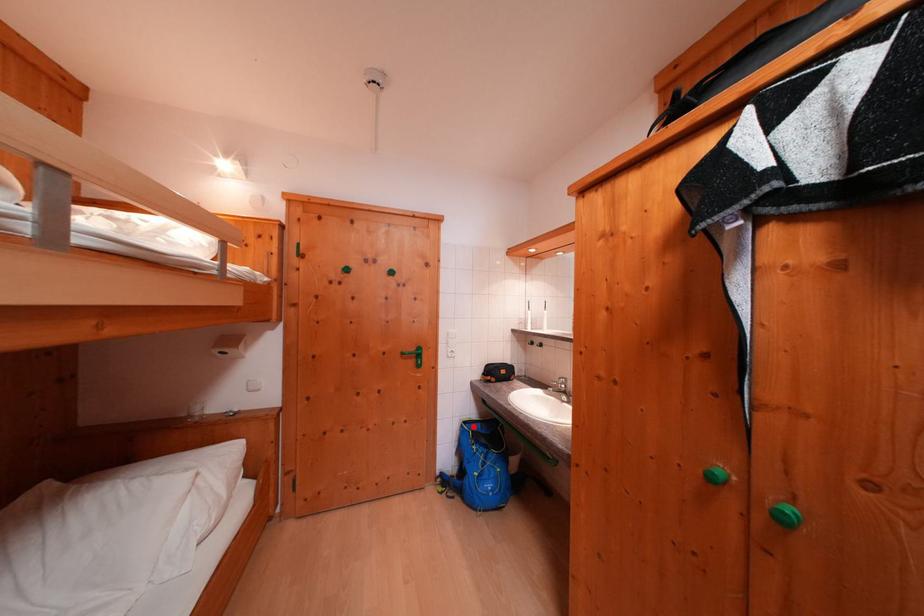
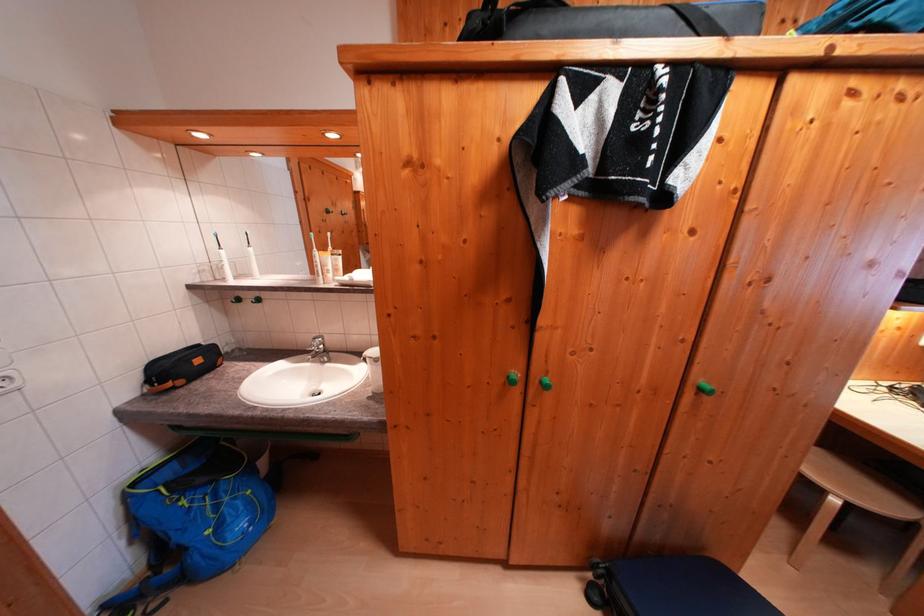
The point at the highlighted location is marked in the first image. Where is the corresponding point in the second image?

(142, 488)